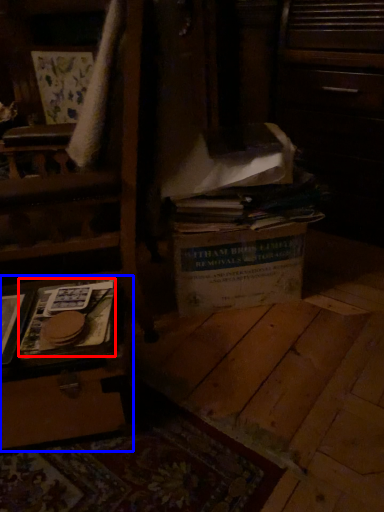
Question: Among these objects, which one is farthest to the camera, paperback book (highlighted by a red box) or vanity (highlighted by a blue box)?

Choices:
 (A) paperback book
 (B) vanity

Answer: (A)